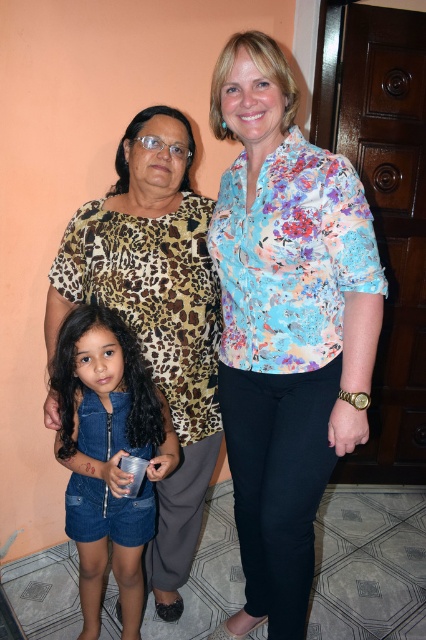
You are an interior designer analyzing the layout of this room. The room has a peach wall and a wooden door on the right. You need to place a new decorative item exactly where the floral print blouse at center is located. What are the coordinates of the point where you should place it?

The coordinates for placing the decorative item should be at point (x=285, y=324), as that is the 2D location of the floral print blouse at center.

In the scene described, there are two people wearing the floral print blouse at center and the denim romper at lower left. Which of these two is taller?

The floral print blouse at center is much taller than the denim romper at lower left.